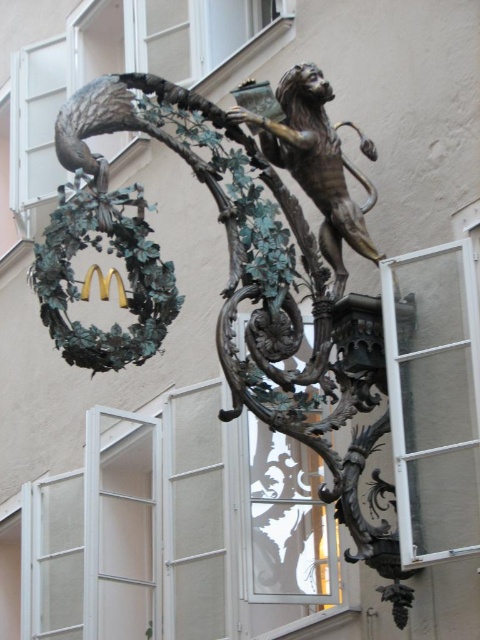
You are a window cleaner who needs to clean both the bronze sculpture at center and the clear glass window at right. Which object requires you to bring a taller ladder?

The bronze sculpture at center requires a taller ladder because it is larger in size than the clear glass window at right, implying it is positioned higher up.

From the picture: You are standing in front of the McDonald sign and want to take a photo of the lion figure. The camera you are using has a maximum focus range of 60 meters. Will the camera be able to focus on the point at coordinates point [177,141]?

The point at coordinates point [177,141] is 66.04 meters away from the camera, which exceeds the camera maximum focus range of 60 meters. Therefore, the camera will not be able to focus on the point at coordinates point [177,141].